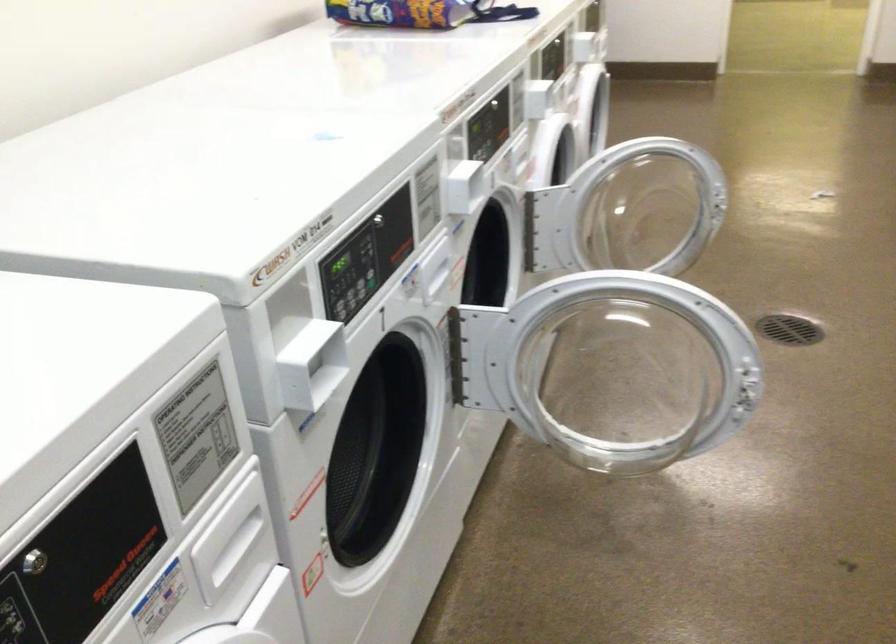
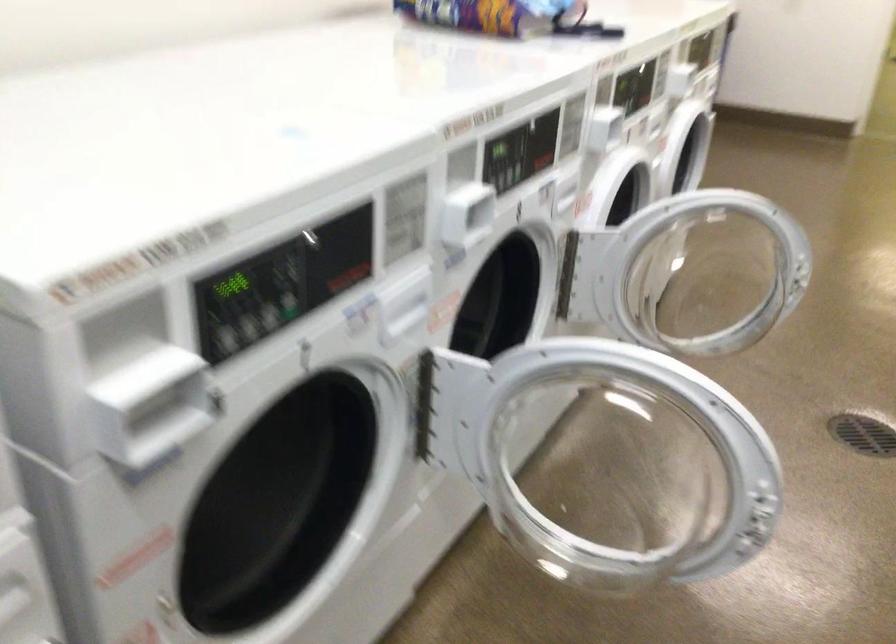
Which direction would the cameraman need to move to produce the second image?

The cameraman moved toward right, forward.